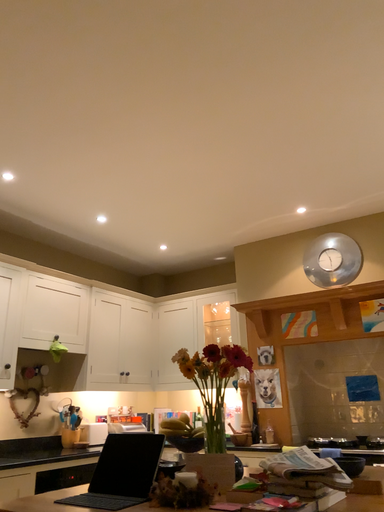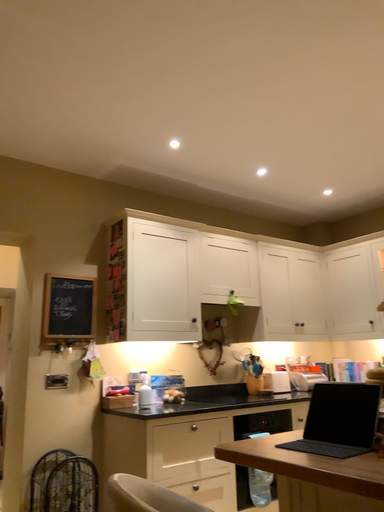
Question: Which way did the camera rotate in the video?

Choices:
 (A) rotated upward
 (B) rotated downward

Answer: (B)